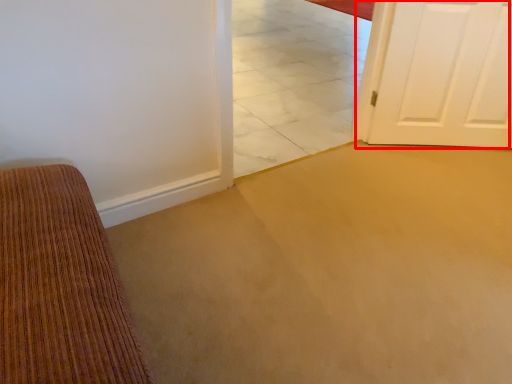
Question: Considering the relative positions of door (annotated by the red box) and tile in the image provided, where is door (annotated by the red box) located with respect to the staircase?

Choices:
 (A) left
 (B) right

Answer: (B)